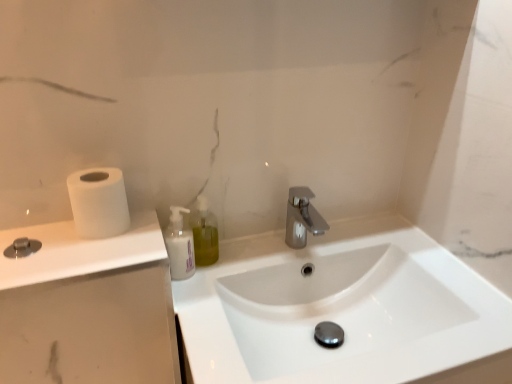
In order to click on blank space situated above white matte countertop at left (from a real-world perspective) in this screenshot , I will do `click(72, 243)`.